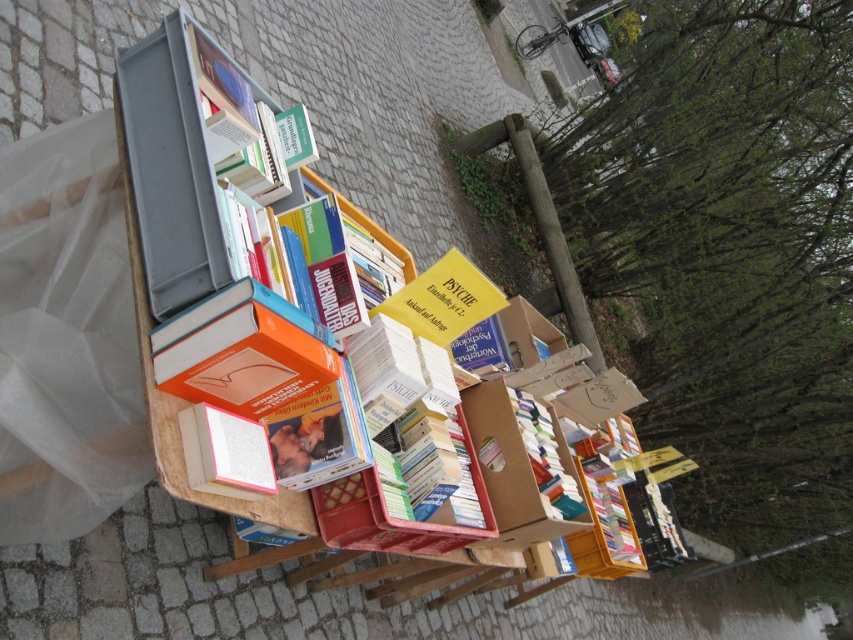
Question: Which of the following is the farthest from the observer?

Choices:
 (A) (251, 307)
 (B) (170, 449)

Answer: (B)

Question: Which object appears closest to the camera in this image?

Choices:
 (A) wooden bookshelf at center
 (B) orange matte book at center

Answer: (B)

Question: Which of the following is the closest to the observer?

Choices:
 (A) (131, 225)
 (B) (238, 340)

Answer: (B)

Question: Does orange matte book at center have a larger size compared to wooden bookshelf at center?

Choices:
 (A) no
 (B) yes

Answer: (A)

Question: Is the position of orange matte book at center more distant than that of wooden bookshelf at center?

Choices:
 (A) yes
 (B) no

Answer: (B)

Question: Is orange matte book at center positioned in front of wooden bookshelf at center?

Choices:
 (A) no
 (B) yes

Answer: (B)